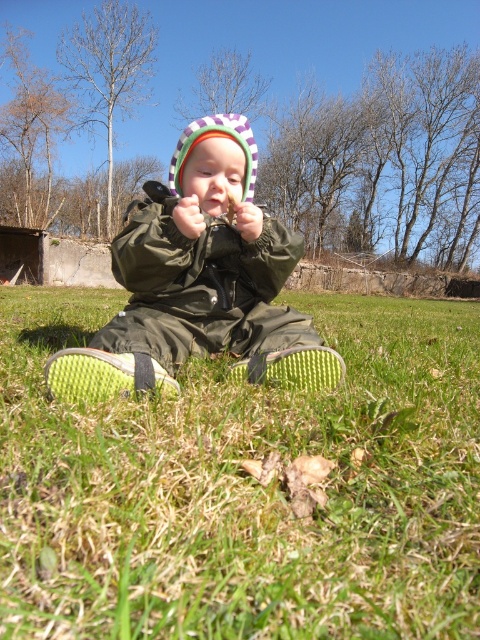
You are a parent trying to locate your child who is playing in the grassy area. You see the green grass at lower center and the green rubber boots at center. How far apart are these two items?

The distance between the green grass at lower center and the green rubber boots at center is 7.75 feet.

You are a photographer trying to capture the scene of the child sitting on the grass. You want to ensure both the green rubber boots at center and the green textured shoe at lower center are clearly visible in the photo. Based on their positions, which boot should you focus on first to frame the shot properly?

The green rubber boots at center is positioned on the left side of green textured shoe at lower center, so you should focus on the green rubber boots at center first to frame the shot properly since it is on the left and closer to the center.